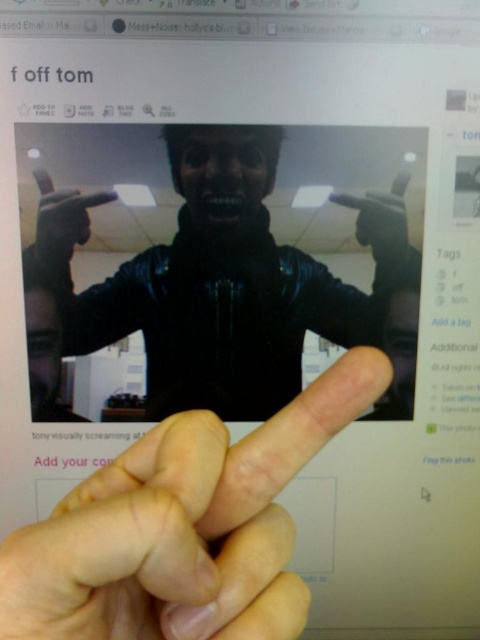
Which is more to the left, black leather jacket at center or pink flesh-toned finger at center?

black leather jacket at center

Does point (182, 170) come closer to viewer compared to point (158, 531)?

No, (182, 170) is further to viewer.

Is point (324, 282) more distant than point (154, 593)?

Yes, it is.

Identify the location of black leather jacket at center. Image resolution: width=480 pixels, height=640 pixels. (230, 284).